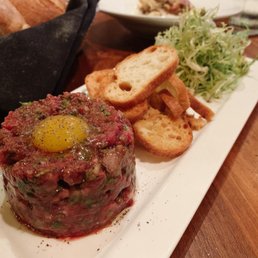
Where is `black napkin`? This screenshot has height=258, width=258. black napkin is located at coordinates (73, 20).